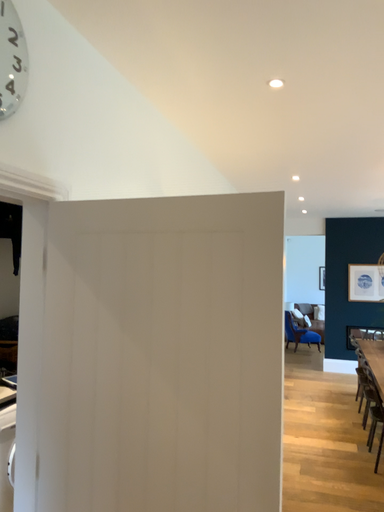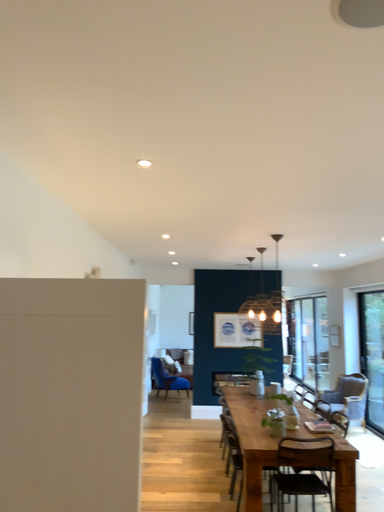
Question: Which way did the camera rotate in the video?

Choices:
 (A) rotated right
 (B) rotated left

Answer: (A)